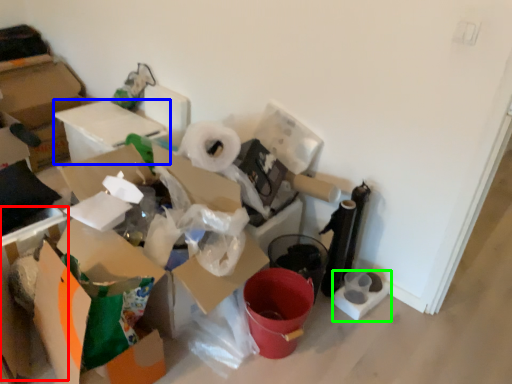
Question: Estimate the real-world distances between objects in this image. Which object is farther from cardboard box (highlighted by a red box), cardboard box (highlighted by a blue box) or toilet paper (highlighted by a green box)?

Choices:
 (A) cardboard box
 (B) toilet paper

Answer: (B)